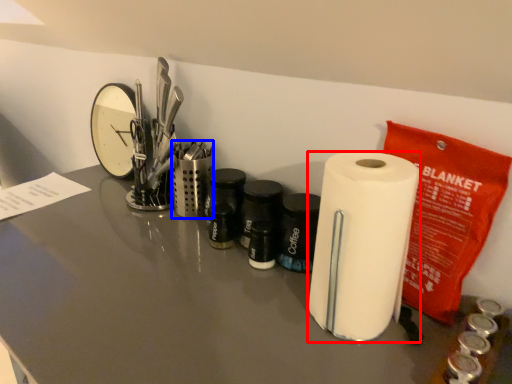
Question: Which of the following is the farthest to the observer, paper towel (highlighted by a red box) or stationery (highlighted by a blue box)?

Choices:
 (A) paper towel
 (B) stationery

Answer: (B)